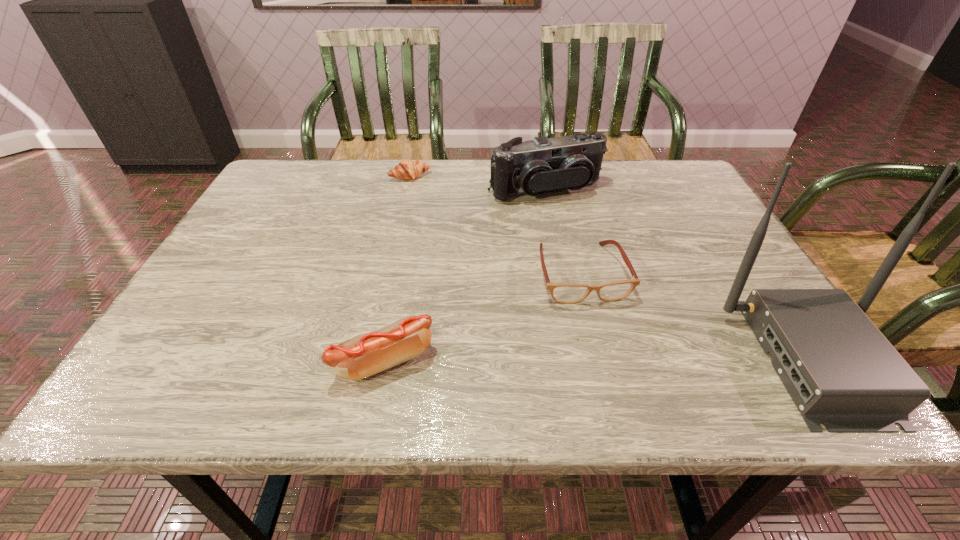
Where is `vacant spot on the desktop that is between the sausage and the router and is positioned on the front-facing side of the second tallest object`? This screenshot has width=960, height=540. vacant spot on the desktop that is between the sausage and the router and is positioned on the front-facing side of the second tallest object is located at coordinates (661, 360).

Find the location of `vacant space on the desktop that is between the third tallest object and the rightmost object and is positioned on the front-facing side of the fourth tallest object`. vacant space on the desktop that is between the third tallest object and the rightmost object and is positioned on the front-facing side of the fourth tallest object is located at coordinates (612, 360).

Find the location of `vacant space on the desktop that is between the third shortest object and the router and is positioned on the front-facing side of the pastry`. vacant space on the desktop that is between the third shortest object and the router and is positioned on the front-facing side of the pastry is located at coordinates pyautogui.click(x=537, y=360).